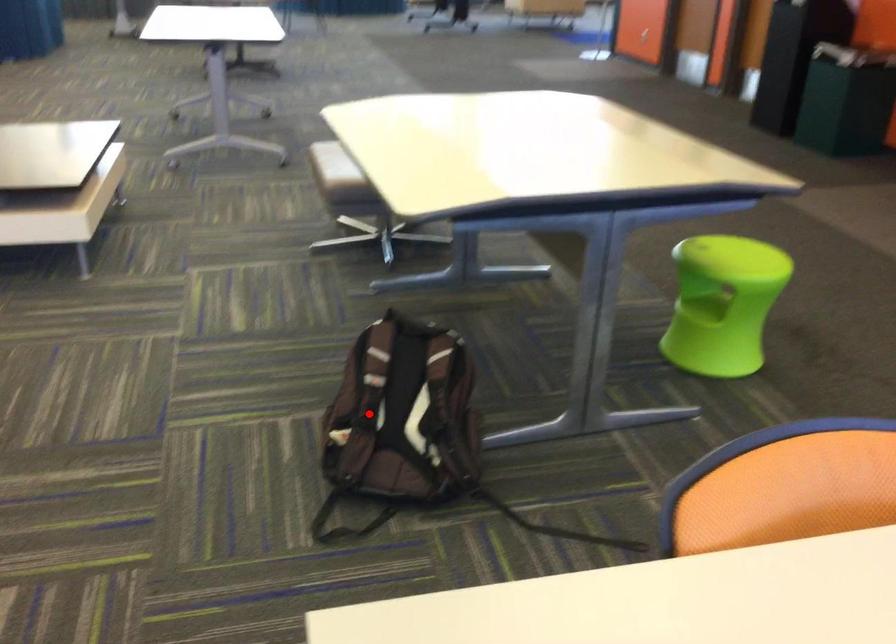
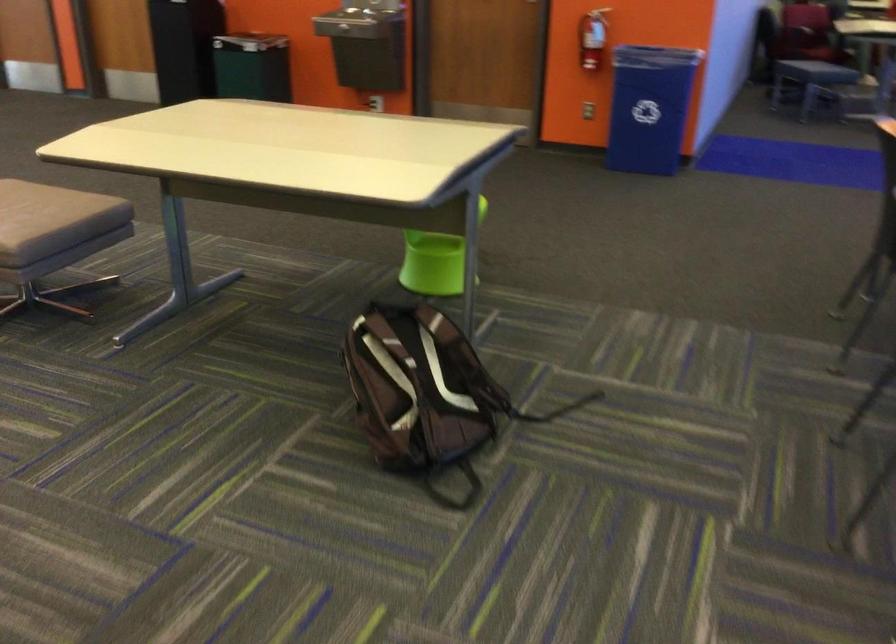
In the second image, find the point that corresponds to the highlighted location in the first image.

(419, 392)